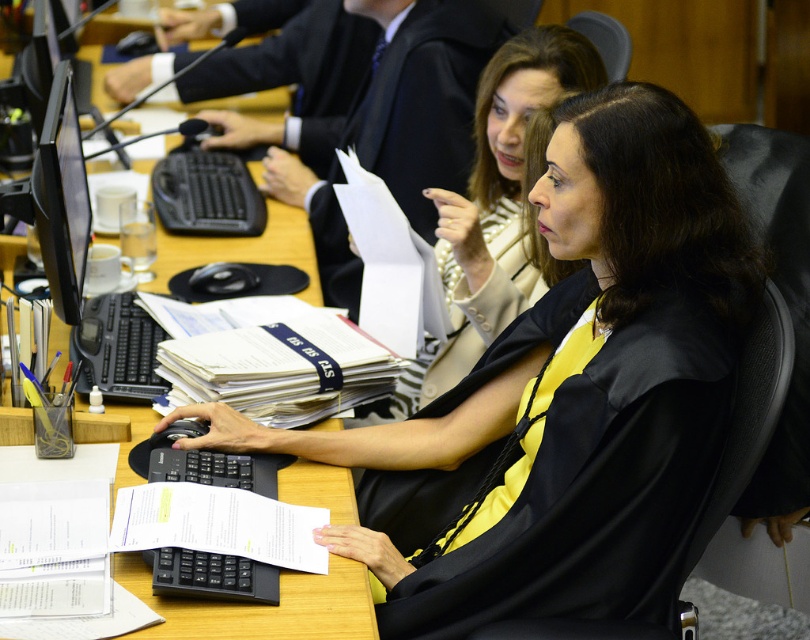
The image size is (810, 640). I want to click on wooden table at center, so click(263, 605).

Does wooden table at center come in front of black plastic keyboard at center?

Yes, wooden table at center is closer to the viewer.

Who is more forward, (259,243) or (164,173)?

Point (259,243)

Locate an element on the screen. wooden table at center is located at coordinates (263, 605).

What do you see at coordinates (390, 264) in the screenshot?
I see `white paper at center` at bounding box center [390, 264].

Which is behind, point (372, 186) or point (152, 340)?

Positioned behind is point (372, 186).

Does point (361, 202) lie behind point (104, 348)?

Yes, it is behind point (104, 348).

Image resolution: width=810 pixels, height=640 pixels. What are the coordinates of `white paper at center` in the screenshot? It's located at (390, 264).

Measure the distance between black matte judge's robe at center and camera.

black matte judge's robe at center and camera are 1.64 meters apart from each other.

Identify the location of black matte judge's robe at center. The image size is (810, 640). (561, 394).

Is point (651, 273) positioned before point (70, 173)?

Yes.

Find the location of a particular element. black matte judge's robe at center is located at coordinates (561, 394).